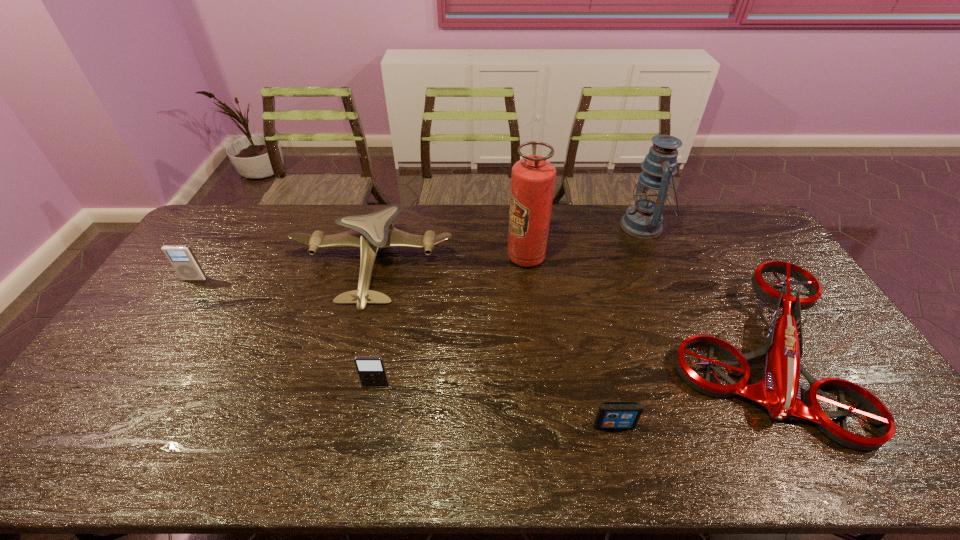
Locate an element on the screen. This screenshot has width=960, height=540. vacant space located on the front screen of the shortest iPod is located at coordinates (621, 458).

I want to click on fire extinguisher situated at the far edge, so click(x=532, y=179).

The image size is (960, 540). I want to click on lantern located in the far edge section of the desktop, so click(x=644, y=219).

Where is `drone that is at the far edge`? The width and height of the screenshot is (960, 540). drone that is at the far edge is located at coordinates (370, 232).

Locate an element on the screen. The width and height of the screenshot is (960, 540). object that is positioned at the near edge is located at coordinates (779, 392).

This screenshot has width=960, height=540. I want to click on object present at the left edge, so click(181, 257).

At what (x,y) coordinates should I click in order to perform the action: click on object located in the right edge section of the desktop. Please return your answer as a coordinate pair (x, y). The image size is (960, 540). Looking at the image, I should click on (779, 392).

At what (x,y) coordinates should I click in order to perform the action: click on object situated at the near right corner. Please return your answer as a coordinate pair (x, y). Image resolution: width=960 pixels, height=540 pixels. Looking at the image, I should click on (779, 392).

In the image, there is a desktop. Where is `vacant space at the far edge`? This screenshot has width=960, height=540. vacant space at the far edge is located at coordinates (506, 217).

At what (x,y) coordinates should I click in order to perform the action: click on vacant region at the near edge of the desktop. Please return your answer as a coordinate pair (x, y). Looking at the image, I should click on (337, 451).